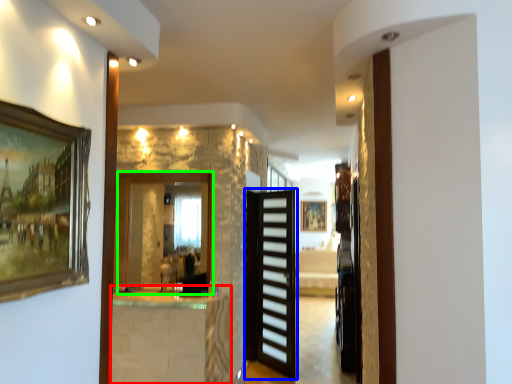
Question: Considering the real-world distances, which object is closest to table (highlighted by a red box)? door (highlighted by a blue box) or mirror (highlighted by a green box).

Choices:
 (A) door
 (B) mirror

Answer: (B)